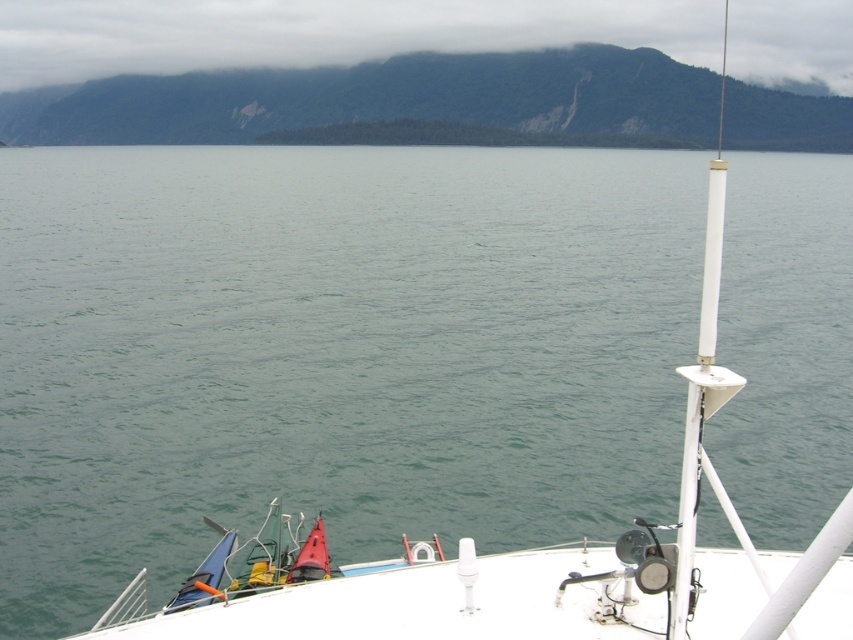
You are a sailor on the deck of the boat. You notice the green forested mountain at upper center and the cloudy fog at upper center. How far apart are these two features from each other?

The green forested mountain at upper center and the cloudy fog at upper center are 26.86 meters apart from each other.